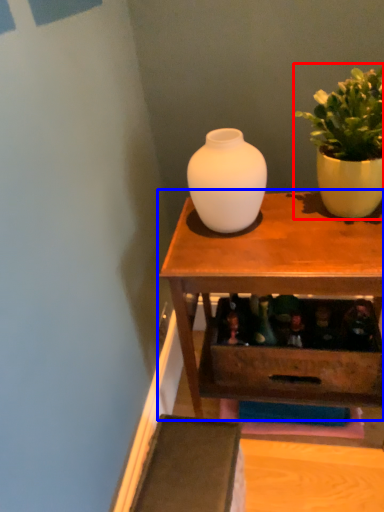
Question: Which point is further to the camera, houseplant (highlighted by a red box) or table (highlighted by a blue box)?

Choices:
 (A) houseplant
 (B) table

Answer: (B)